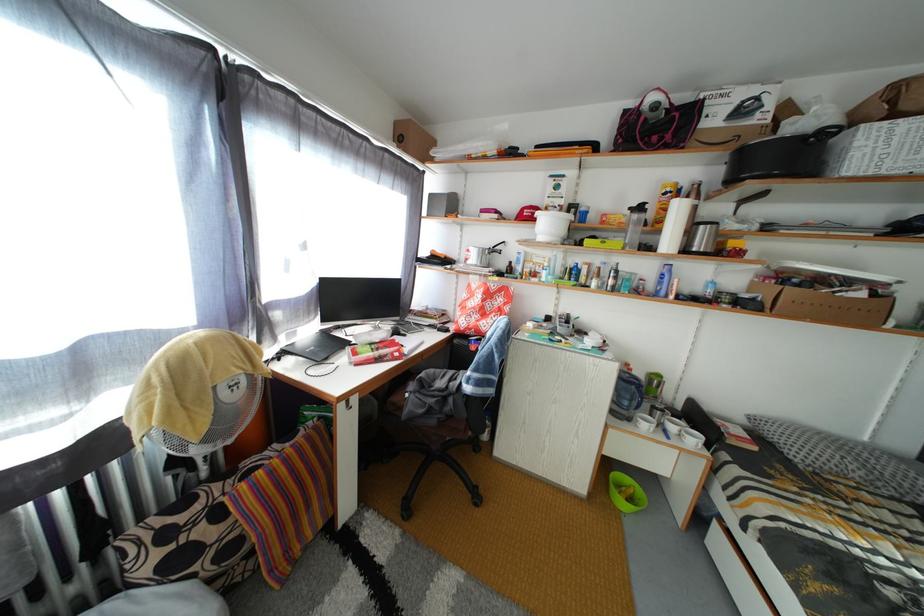
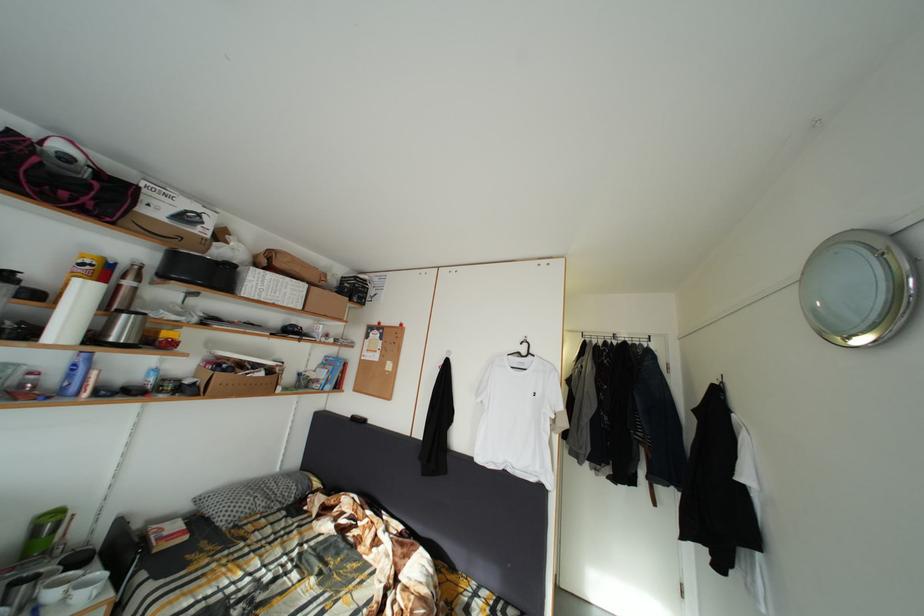
Locate, in the second image, the point that corresponds to (674,200) in the first image.

(91, 270)